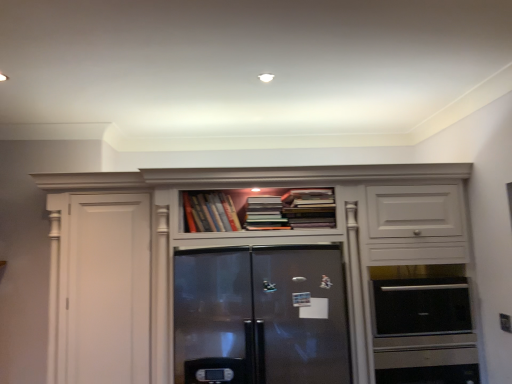
This screenshot has height=384, width=512. In order to click on hardcover books at center, the third book when ordered from right to left in this screenshot , I will do (210, 212).

What do you see at coordinates (252, 277) in the screenshot? I see `matte white cabinet at center` at bounding box center [252, 277].

The height and width of the screenshot is (384, 512). Describe the element at coordinates (266, 288) in the screenshot. I see `satin stainless steel refrigerator at center` at that location.

I want to click on satin black oven at right, so click(421, 306).

Can you confirm if hardcover books at center, arranged as the 2th book when viewed from the left, is thinner than hardcover books at center, the third book when ordered from right to left?

No.

From the image's perspective, which one is positioned higher, hardcover books at center, arranged as the 2th book when viewed from the left, or hardcover books at center, the third book when ordered from right to left?

hardcover books at center, the third book when ordered from right to left, from the image's perspective.

Who is more distant, hardcover books at center, arranged as the 2th book when viewed from the left, or hardcover books at center, acting as the first book starting from the left?

hardcover books at center, acting as the first book starting from the left.

Looking at this image, considering the relative sizes of hardcover books at center, arranged as the second book when viewed from the right, and hardcover books at center, the third book when ordered from right to left, in the image provided, is hardcover books at center, arranged as the second book when viewed from the right, bigger than hardcover books at center, the third book when ordered from right to left,?

Yes, hardcover books at center, arranged as the second book when viewed from the right, is bigger than hardcover books at center, the third book when ordered from right to left.

Would you consider hardcover books at center, arranged as the second book when viewed from the right, to be distant from hardcover books at upper center, the first book positioned from the right?

No, hardcover books at center, arranged as the second book when viewed from the right, is not far from hardcover books at upper center, the first book positioned from the right.

Is hardcover books at center, arranged as the second book when viewed from the right, to the left of hardcover books at upper center, marked as the 3th book in a left-to-right arrangement, from the viewer's perspective?

Yes, hardcover books at center, arranged as the second book when viewed from the right, is to the left of hardcover books at upper center, marked as the 3th book in a left-to-right arrangement.

Consider the image. Is hardcover books at center, arranged as the 2th book when viewed from the left, not inside hardcover books at upper center, the first book positioned from the right?

Yes, hardcover books at center, arranged as the 2th book when viewed from the left, is not within hardcover books at upper center, the first book positioned from the right.

From a real-world perspective, is hardcover books at center, arranged as the second book when viewed from the right, on hardcover books at upper center, the first book positioned from the right?

No, from a real-world perspective, hardcover books at center, arranged as the second book when viewed from the right, is not on top of hardcover books at upper center, the first book positioned from the right.

From the image's perspective, which one is positioned higher, hardcover books at center, arranged as the second book when viewed from the right, or satin black oven at right?

hardcover books at center, arranged as the second book when viewed from the right, appears higher in the image.

Is hardcover books at center, arranged as the 2th book when viewed from the left, oriented away from satin black oven at right?

No, satin black oven at right is not at the back of hardcover books at center, arranged as the 2th book when viewed from the left.

Is hardcover books at center, arranged as the 2th book when viewed from the left, beside satin black oven at right?

No, hardcover books at center, arranged as the 2th book when viewed from the left, is not beside satin black oven at right.

Is satin black oven at right located within hardcover books at center, arranged as the 2th book when viewed from the left?

No, satin black oven at right is located outside of hardcover books at center, arranged as the 2th book when viewed from the left.

From the image's perspective, between satin stainless steel refrigerator at center and hardcover books at upper center, the first book positioned from the right, which one is located above?

From the image's view, hardcover books at upper center, the first book positioned from the right, is above.

This screenshot has width=512, height=384. Find the location of `the 2nd book above the satin stainless steel refrigerator at center (from a real-world perspective)`. the 2nd book above the satin stainless steel refrigerator at center (from a real-world perspective) is located at coordinates (309, 208).

Which of these two, satin stainless steel refrigerator at center or hardcover books at upper center, the first book positioned from the right, stands taller?

Standing taller between the two is satin stainless steel refrigerator at center.

Would you say satin stainless steel refrigerator at center is outside hardcover books at upper center, the first book positioned from the right?

Yes, satin stainless steel refrigerator at center is outside of hardcover books at upper center, the first book positioned from the right.

Is matte white cabinet at center not close to hardcover books at center, arranged as the second book when viewed from the right?

No, matte white cabinet at center is in close proximity to hardcover books at center, arranged as the second book when viewed from the right.

Is matte white cabinet at center to the left of hardcover books at center, arranged as the 2th book when viewed from the left, from the viewer's perspective?

Yes.

From a real-world perspective, who is located lower, matte white cabinet at center or hardcover books at center, arranged as the 2th book when viewed from the left?

matte white cabinet at center is physically lower.

Could hardcover books at center, arranged as the second book when viewed from the right, be considered to be inside matte white cabinet at center?

Yes.

Which is behind, satin stainless steel refrigerator at center or hardcover books at center, arranged as the 2th book when viewed from the left?

hardcover books at center, arranged as the 2th book when viewed from the left, is further away from the camera.

Would you say satin stainless steel refrigerator at center is inside or outside hardcover books at center, arranged as the second book when viewed from the right?

satin stainless steel refrigerator at center is not enclosed by hardcover books at center, arranged as the second book when viewed from the right.

This screenshot has width=512, height=384. In order to click on cupboard that is in front of the hardcover books at center, arranged as the 2th book when viewed from the left in this screenshot , I will do `click(266, 288)`.

Based on the photo, how different are the orientations of satin stainless steel refrigerator at center and hardcover books at center, arranged as the 2th book when viewed from the left, in degrees?

0.0018 degrees.

Which is behind, point (218, 225) or point (461, 301)?

The point (461, 301) is more distant.

Is hardcover books at center, acting as the first book starting from the left, positioned far away from satin black oven at right?

Yes.

Looking at their sizes, would you say hardcover books at center, acting as the first book starting from the left, is wider or thinner than satin black oven at right?

hardcover books at center, acting as the first book starting from the left, is thinner than satin black oven at right.

Considering the sizes of objects hardcover books at center, acting as the first book starting from the left, and satin black oven at right in the image provided, who is taller, hardcover books at center, acting as the first book starting from the left, or satin black oven at right?

satin black oven at right is taller.

This screenshot has width=512, height=384. I want to click on book that is the 1st one when counting upward from the hardcover books at center, arranged as the 2th book when viewed from the left (from the image's perspective), so click(x=210, y=212).

Where is `book that is the 1st one when counting leftward from the hardcover books at upper center, marked as the 3th book in a left-to-right arrangement`? book that is the 1st one when counting leftward from the hardcover books at upper center, marked as the 3th book in a left-to-right arrangement is located at coordinates (265, 214).

Based on their spatial positions, is satin stainless steel refrigerator at center or satin black oven at right closer to matte white cabinet at center?

The object closer to matte white cabinet at center is satin stainless steel refrigerator at center.

From the image, which object appears to be nearer to hardcover books at center, arranged as the 2th book when viewed from the left, hardcover books at upper center, the first book positioned from the right, or matte white cabinet at center?

Based on the image, hardcover books at upper center, the first book positioned from the right, appears to be nearer to hardcover books at center, arranged as the 2th book when viewed from the left.

Looking at the image, which one is located further to satin stainless steel refrigerator at center, hardcover books at center, arranged as the 2th book when viewed from the left, or hardcover books at center, the third book when ordered from right to left?

hardcover books at center, arranged as the 2th book when viewed from the left, is positioned further to the anchor satin stainless steel refrigerator at center.

In the scene shown: From the image, which object appears to be farther from hardcover books at center, the third book when ordered from right to left, hardcover books at upper center, the first book positioned from the right, or satin stainless steel refrigerator at center?

hardcover books at upper center, the first book positioned from the right.

Which object lies further to the anchor point satin black oven at right, hardcover books at upper center, marked as the 3th book in a left-to-right arrangement, or hardcover books at center, arranged as the second book when viewed from the right?

hardcover books at center, arranged as the second book when viewed from the right.

Which object lies further to the anchor point satin stainless steel refrigerator at center, hardcover books at upper center, the first book positioned from the right, or hardcover books at center, the third book when ordered from right to left?

hardcover books at upper center, the first book positioned from the right.

When comparing their distances from hardcover books at center, the third book when ordered from right to left, does satin stainless steel refrigerator at center or hardcover books at upper center, the first book positioned from the right, seem closer?

satin stainless steel refrigerator at center.

Looking at the image, which one is located further to satin black oven at right, matte white cabinet at center or satin stainless steel refrigerator at center?

Based on the image, satin stainless steel refrigerator at center appears to be further to satin black oven at right.

At what (x,y) coordinates should I click in order to perform the action: click on cabinetry situated between hardcover books at center, the third book when ordered from right to left, and hardcover books at upper center, marked as the 3th book in a left-to-right arrangement, from left to right. Please return your answer as a coordinate pair (x, y). The height and width of the screenshot is (384, 512). Looking at the image, I should click on (252, 277).

Where is `book between hardcover books at center, arranged as the 2th book when viewed from the left, and satin black oven at right, in the horizontal direction`? book between hardcover books at center, arranged as the 2th book when viewed from the left, and satin black oven at right, in the horizontal direction is located at coordinates (309, 208).

Identify the location of cupboard between matte white cabinet at center and satin black oven at right in the horizontal direction. (266, 288).

You are a GUI agent. You are given a task and a screenshot of the screen. Output one action in this format:
    pyautogui.click(x=<x>, y=<y>)
    Task: Click on the cabinetry between hardcover books at center, acting as the first book starting from the left, and satin stainless steel refrigerator at center in the up-down direction
    This screenshot has width=512, height=384.
    Given the screenshot: What is the action you would take?
    pyautogui.click(x=252, y=277)